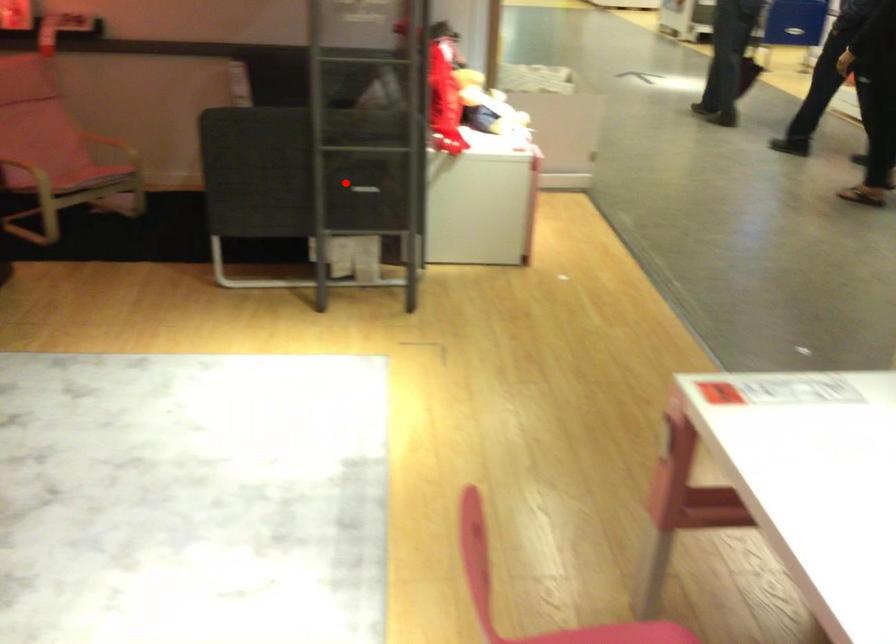
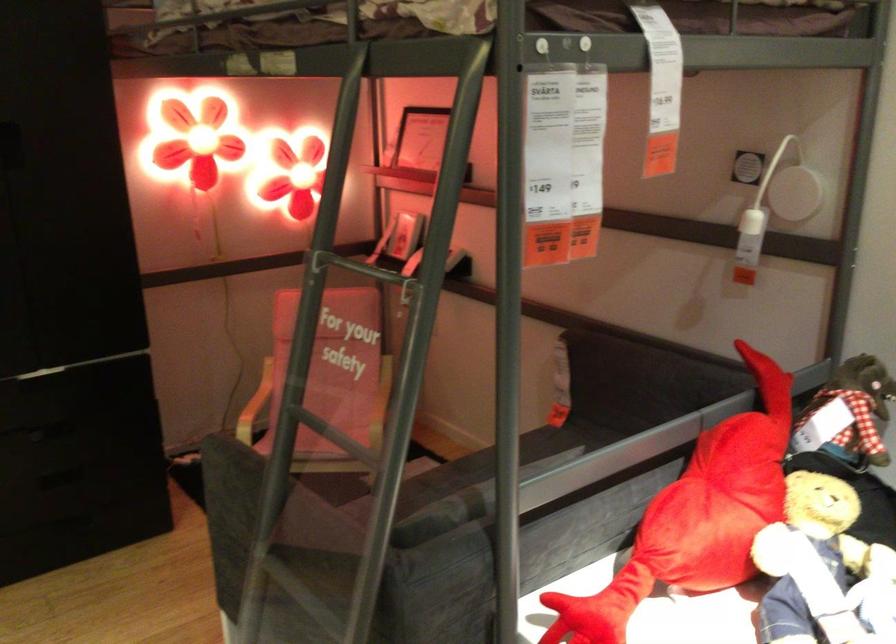
Where in the second image is the point corresponding to the highlighted location from the first image?

(293, 609)